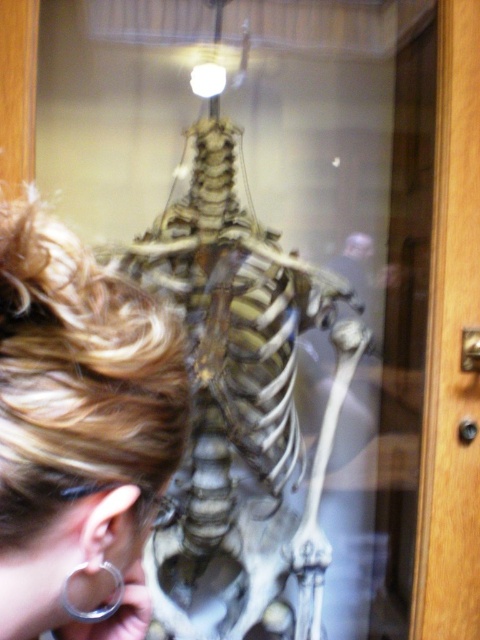
Does bone-like skeleton at center have a smaller size compared to blonde hair at upper left?

No, bone-like skeleton at center is not smaller than blonde hair at upper left.

Which is in front, point (144, 268) or point (60, 401)?

Positioned in front is point (60, 401).

Is point (313, 273) more distant than point (59, 467)?

Yes, point (313, 273) is behind point (59, 467).

At what (x,y) coordinates should I click in order to perform the action: click on bone-like skeleton at center. Please return your answer as a coordinate pair (x, y). The height and width of the screenshot is (640, 480). Looking at the image, I should click on 241,403.

Can you confirm if blonde hair at upper left is positioned to the left of silver metallic ring at lower left?

Yes, blonde hair at upper left is to the left of silver metallic ring at lower left.

Between blonde hair at upper left and silver metallic ring at lower left, which one appears on the right side from the viewer's perspective?

Positioned to the right is silver metallic ring at lower left.

Image resolution: width=480 pixels, height=640 pixels. Describe the element at coordinates (79, 422) in the screenshot. I see `blonde hair at upper left` at that location.

Locate an element on the screen. blonde hair at upper left is located at coordinates (79, 422).

Who is more forward, (321, 454) or (91, 576)?

Point (91, 576) is more forward.

Does bone-like skeleton at center appear on the left side of silver metallic ring at lower left?

Incorrect, bone-like skeleton at center is not on the left side of silver metallic ring at lower left.

Find the location of `bone-like skeleton at center`. bone-like skeleton at center is located at coordinates (241, 403).

Find the location of a particular element. The image size is (480, 640). bone-like skeleton at center is located at coordinates (241, 403).